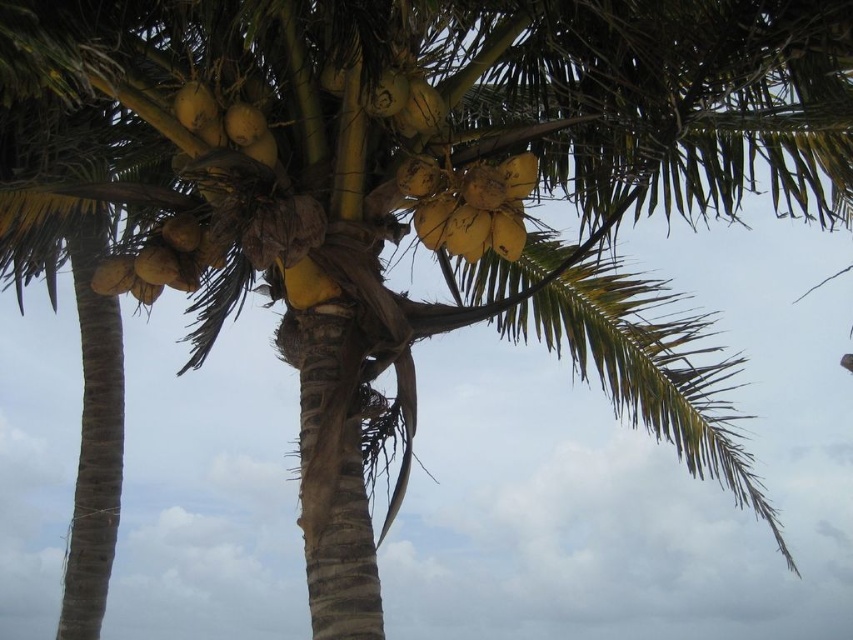
You are a farmer inspecting the coconut palm tree. You notice the yellow matte coconut at upper center and the yellow matte coconuts at center. Which one is smaller in size?

The yellow matte coconut at upper center is smaller in size compared to the yellow matte coconuts at center.

From the picture: You are standing in front of the coconut palm tree and want to determine which of the two points, point (419, 186) or point (215, 266), is nearer to you. Based on the image, which point is closer?

Point (419, 186) is closer to the viewer than point (215, 266).